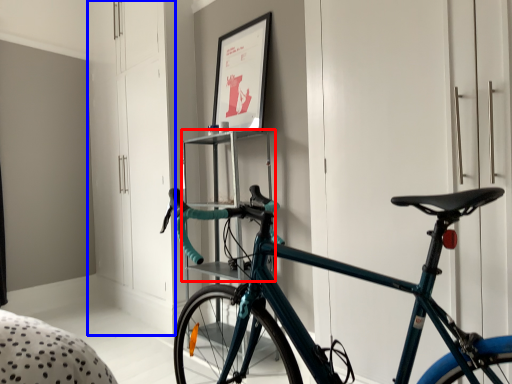
Question: Which object is further to the camera taking this photo, shelf (highlighted by a red box) or dresser (highlighted by a blue box)?

Choices:
 (A) shelf
 (B) dresser

Answer: (B)